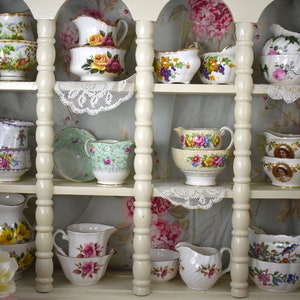
Where is `cups on middle shelf`? The width and height of the screenshot is (300, 300). cups on middle shelf is located at coordinates (69, 170), (11, 154), (13, 137), (118, 161), (192, 153), (189, 143), (282, 145), (281, 164).